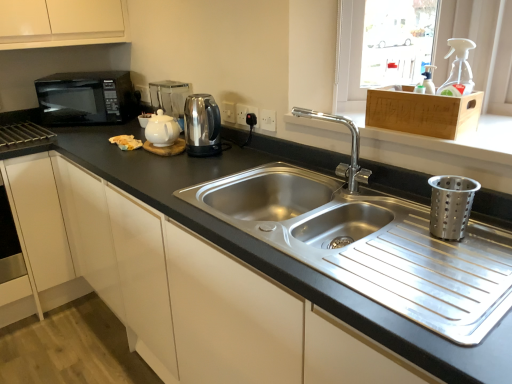
You are a GUI agent. You are given a task and a screenshot of the screen. Output one action in this format:
    pyautogui.click(x=<x>, y=<y>)
    Task: Click on the vacant area on top of wooden crate at upper right (from a real-world perspective)
    This screenshot has height=384, width=512.
    Given the screenshot: What is the action you would take?
    pyautogui.click(x=423, y=87)